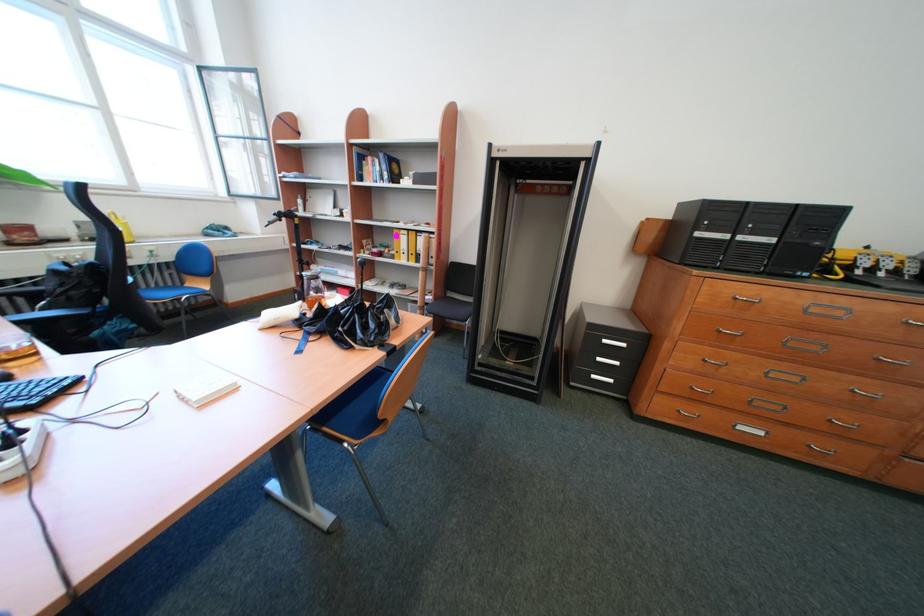
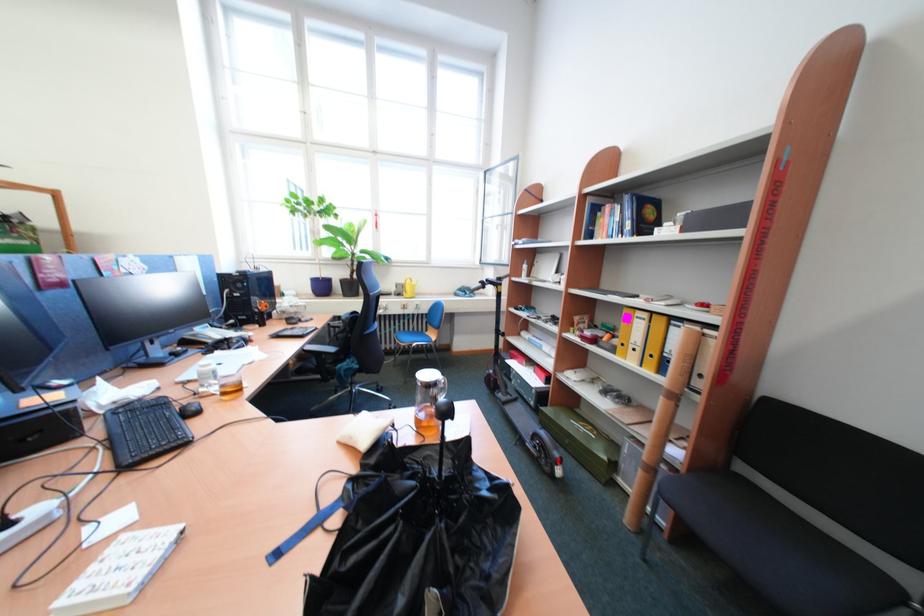
Question: Based on the continuous images, in which direction is the camera rotating? Reply with the corresponding letter.

Choices:
 (A) Left
 (B) Right
 (C) Up
 (D) Down

Answer: (A)